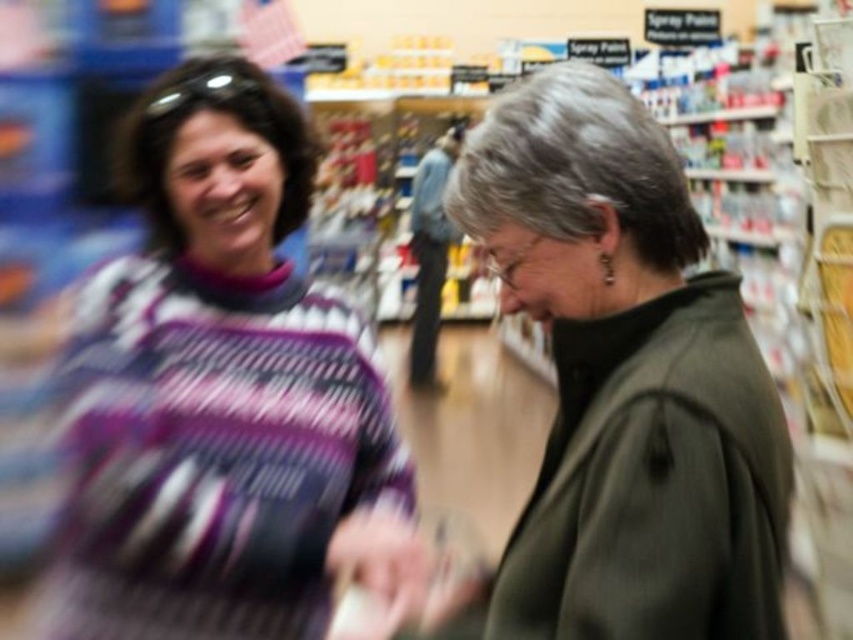
Question: Can you confirm if purple knitted sweater at left is wider than dark green jacket at center?

Choices:
 (A) yes
 (B) no

Answer: (A)

Question: Does purple knitted sweater at left appear over dark green jacket at center?

Choices:
 (A) no
 (B) yes

Answer: (A)

Question: Which of the following is the closest to the observer?

Choices:
 (A) (584, 236)
 (B) (146, 541)

Answer: (A)

Question: Which point appears closest to the camera in this image?

Choices:
 (A) (614, 637)
 (B) (265, 328)

Answer: (A)

Question: Does purple knitted sweater at left appear over dark green jacket at center?

Choices:
 (A) no
 (B) yes

Answer: (A)

Question: Among these points, which one is nearest to the camera?

Choices:
 (A) (573, 316)
 (B) (225, 449)

Answer: (A)